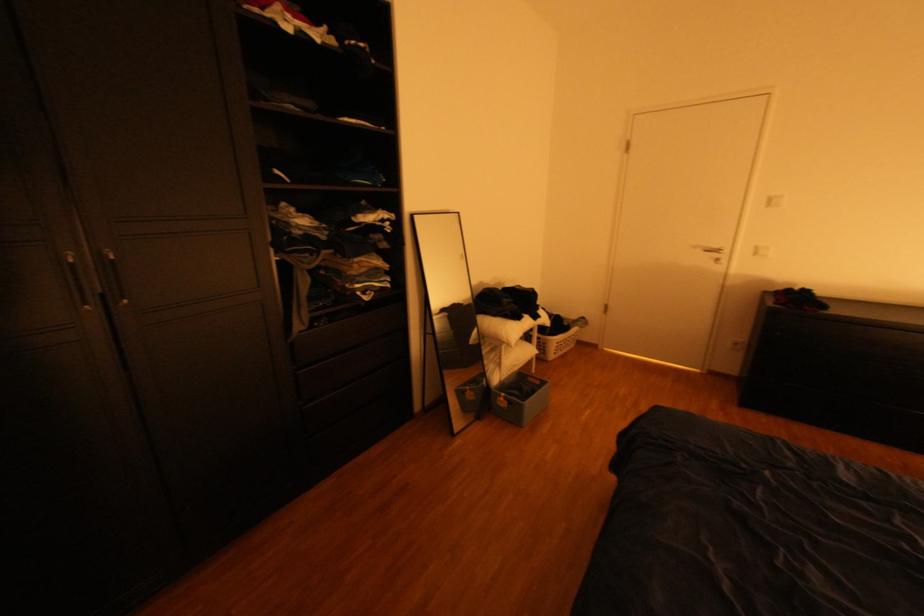
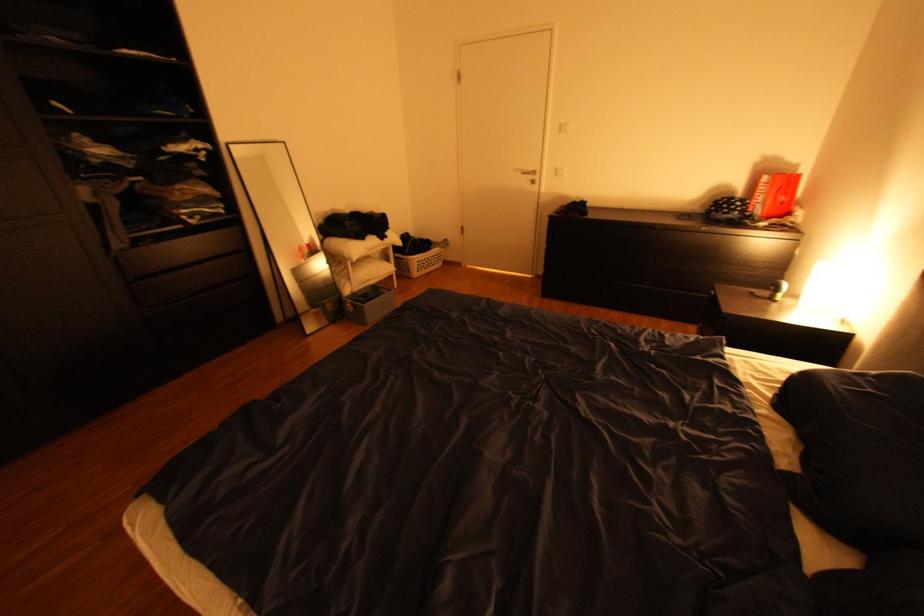
The point at (x=572, y=345) is marked in the first image. Where is the corresponding point in the second image?

(433, 264)